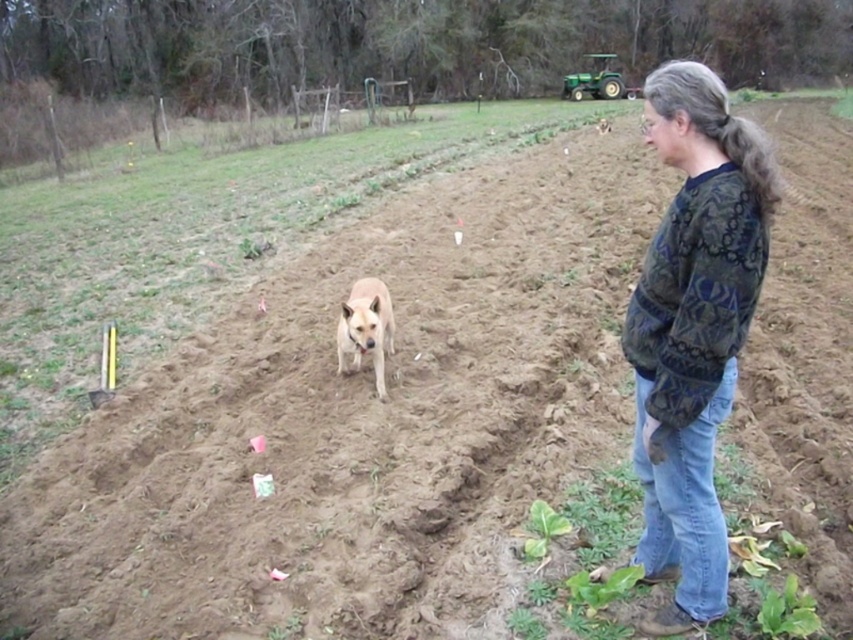
Does dark green sweater at right have a greater height compared to light brown fur at center?

No, dark green sweater at right is not taller than light brown fur at center.

Is dark green sweater at right positioned in front of light brown fur at center?

Yes.

Is point (728, 205) closer to camera compared to point (383, 372)?

Yes.

Image resolution: width=853 pixels, height=640 pixels. Find the location of `dark green sweater at right`. dark green sweater at right is located at coordinates (693, 328).

Locate an element on the screen. Image resolution: width=853 pixels, height=640 pixels. dark green sweater at right is located at coordinates point(693,328).

Does dark green sweater at right appear on the right side of green plastic tractor at upper right?

In fact, dark green sweater at right is to the left of green plastic tractor at upper right.

Where is `dark green sweater at right`? The width and height of the screenshot is (853, 640). dark green sweater at right is located at coordinates click(693, 328).

Can you confirm if grayish-brown hair at upper right is positioned to the right of green plastic tractor at upper right?

Incorrect, grayish-brown hair at upper right is not on the right side of green plastic tractor at upper right.

The image size is (853, 640). In order to click on grayish-brown hair at upper right in this screenshot , I will do `click(787, 161)`.

This screenshot has width=853, height=640. Find the location of `grayish-brown hair at upper right`. grayish-brown hair at upper right is located at coordinates click(x=787, y=161).